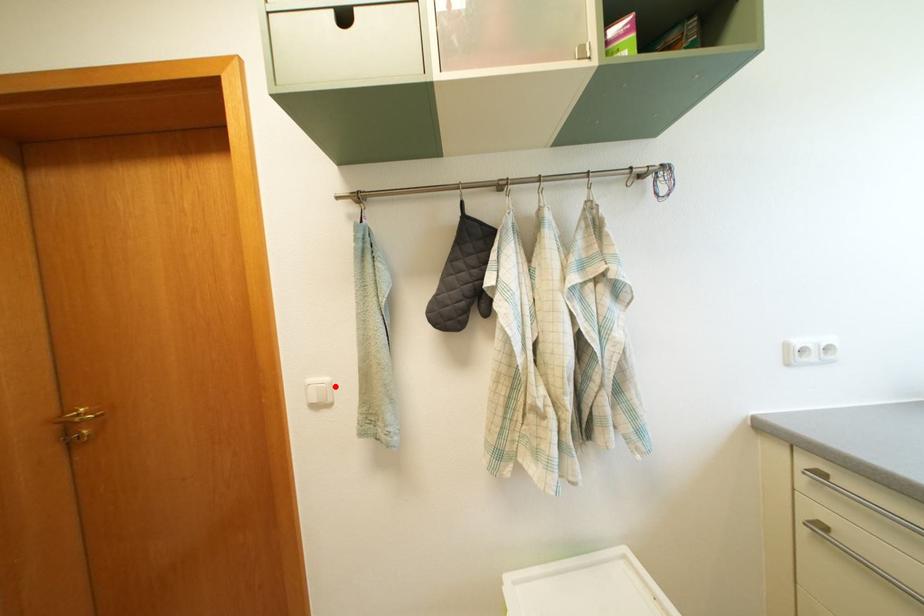
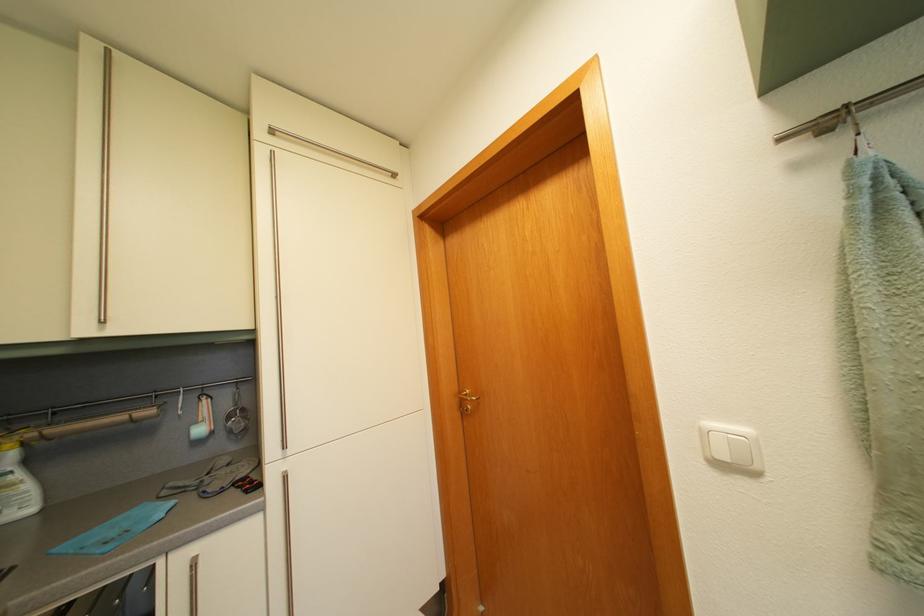
Find the pixel in the second image that matches the highlighted location in the first image.

(755, 438)